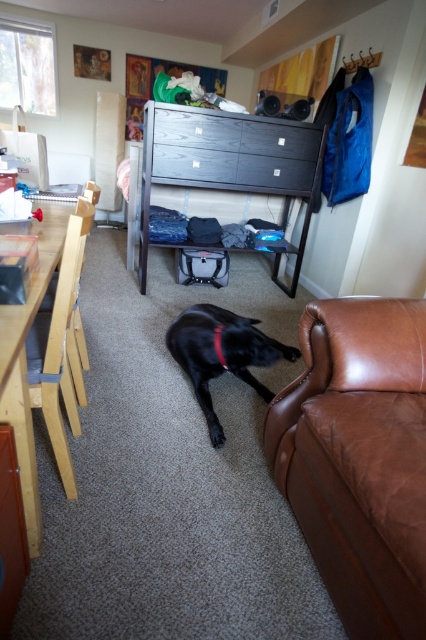
Who is shorter, matte black drawer at center or light wood chair at left?

matte black drawer at center

Who is lower down, matte black drawer at center or light wood chair at left?

Answer: Positioned lower is light wood chair at left.

Identify the location of matte black drawer at center. This screenshot has width=426, height=640. (233, 152).

Which is more to the left, matte black drawer at center or black leather dog at lower center?

From the viewer's perspective, matte black drawer at center appears more on the left side.

Is the position of matte black drawer at center less distant than that of black leather dog at lower center?

That is False.

Measure the distance between point (224, 147) and camera.

Point (224, 147) is 3.26 meters away from camera.

The height and width of the screenshot is (640, 426). Find the location of `matte black drawer at center`. matte black drawer at center is located at coordinates (233, 152).

Is light wood chair at left wider than black leather dog at lower center?

No, light wood chair at left is not wider than black leather dog at lower center.

Is light wood chair at left thinner than black leather dog at lower center?

Indeed, light wood chair at left has a lesser width compared to black leather dog at lower center.

Which is in front, point (63, 449) or point (210, 323)?

Point (63, 449)

Find the location of a particular element. light wood chair at left is located at coordinates point(62,348).